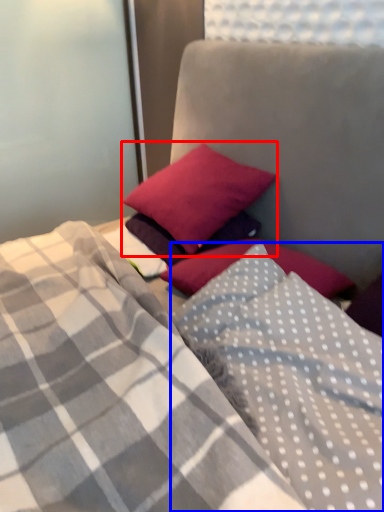
Question: Which object appears closest to the camera in this image, pillow (highlighted by a red box) or pillow (highlighted by a blue box)?

Choices:
 (A) pillow
 (B) pillow

Answer: (B)